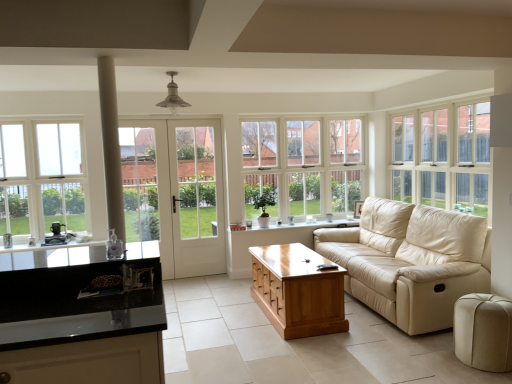
This screenshot has height=384, width=512. Find the location of `free region on the left part of beige velvet ottoman at lower right`. free region on the left part of beige velvet ottoman at lower right is located at coordinates (440, 367).